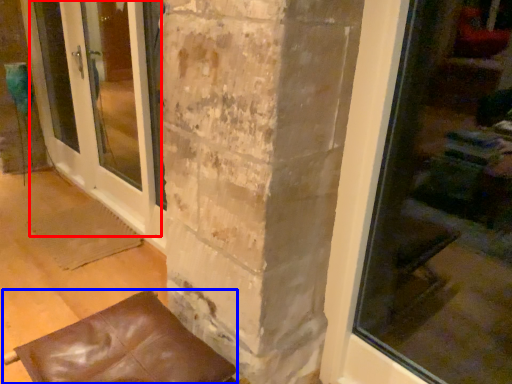
Question: Which object appears farthest to the camera in this image, screen door (highlighted by a red box) or furniture (highlighted by a blue box)?

Choices:
 (A) screen door
 (B) furniture

Answer: (A)